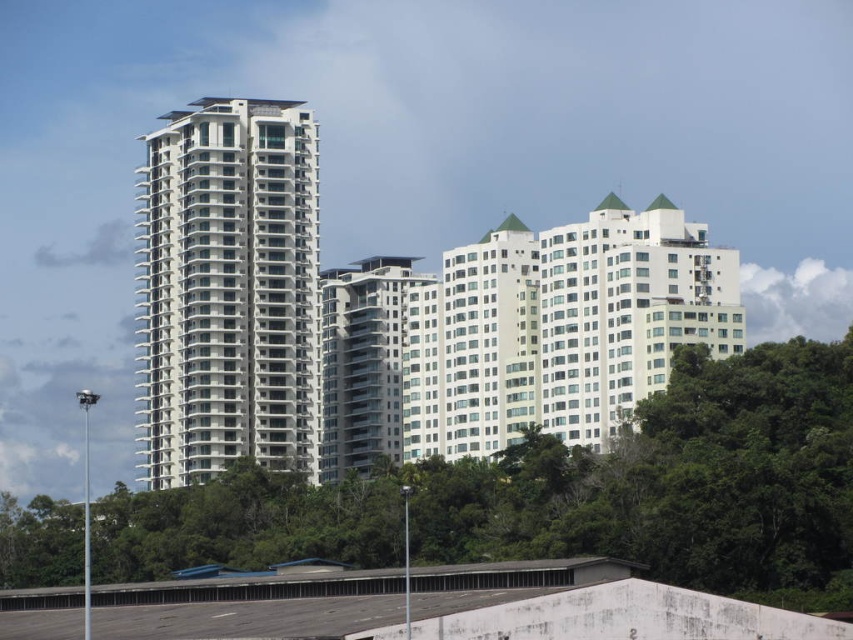
Question: Which point appears farthest from the camera in this image?

Choices:
 (A) (239, 300)
 (B) (715, 584)

Answer: (A)

Question: Is green leafy tree at center to the right of white smooth building at left from the viewer's perspective?

Choices:
 (A) no
 (B) yes

Answer: (B)

Question: Is green leafy tree at center above white smooth building at left?

Choices:
 (A) no
 (B) yes

Answer: (A)

Question: Which point appears closest to the camera in this image?

Choices:
 (A) (149, 408)
 (B) (184, 497)

Answer: (B)

Question: Is green leafy tree at center positioned in front of white smooth building at left?

Choices:
 (A) no
 (B) yes

Answer: (B)

Question: Which object is farther from the camera taking this photo?

Choices:
 (A) white smooth building at left
 (B) white glass building at center

Answer: (B)